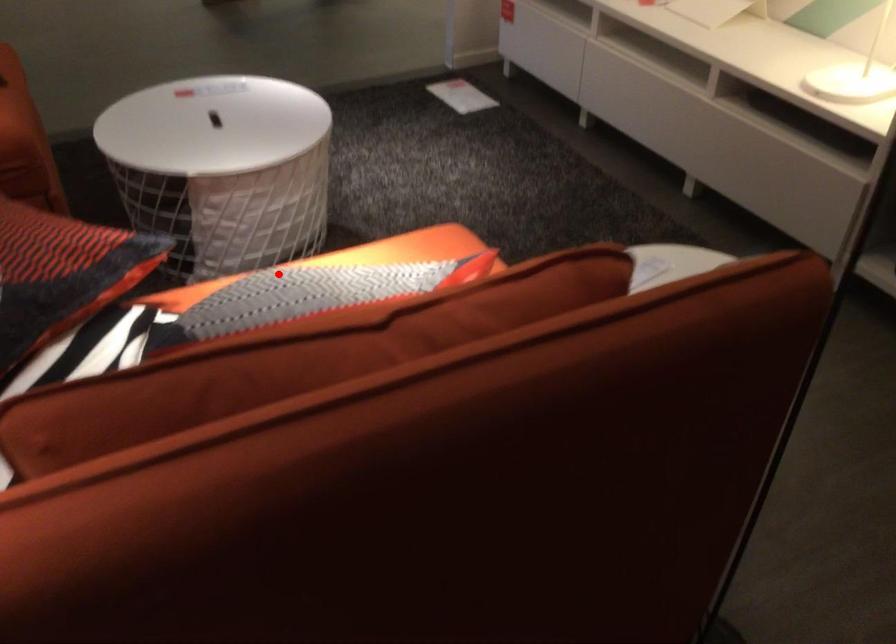
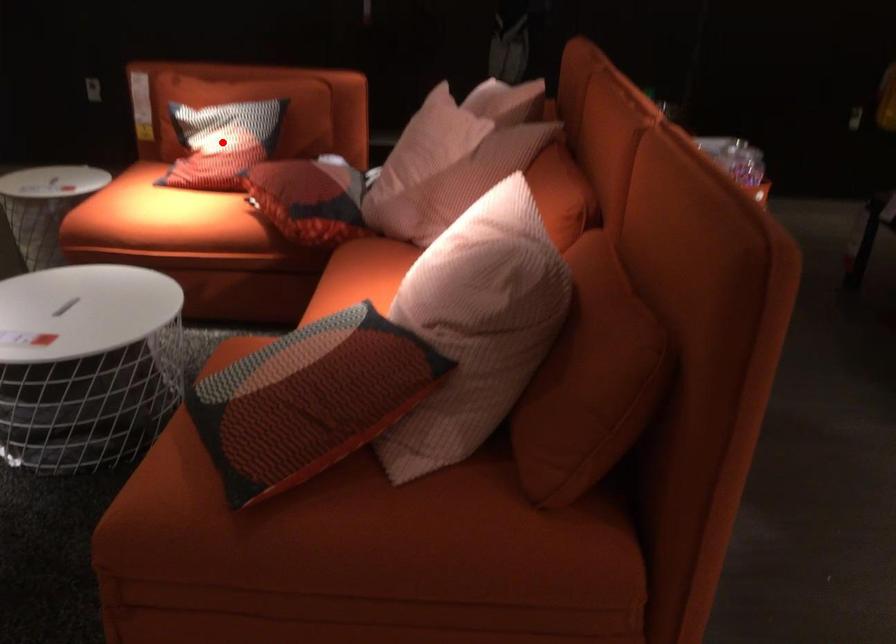
I am providing you with two images of the same scene from different viewpoints. A red point is marked on the first image and another point is marked on the second image. Is the red point in image1 aligned with the point shown in image2?

Yes